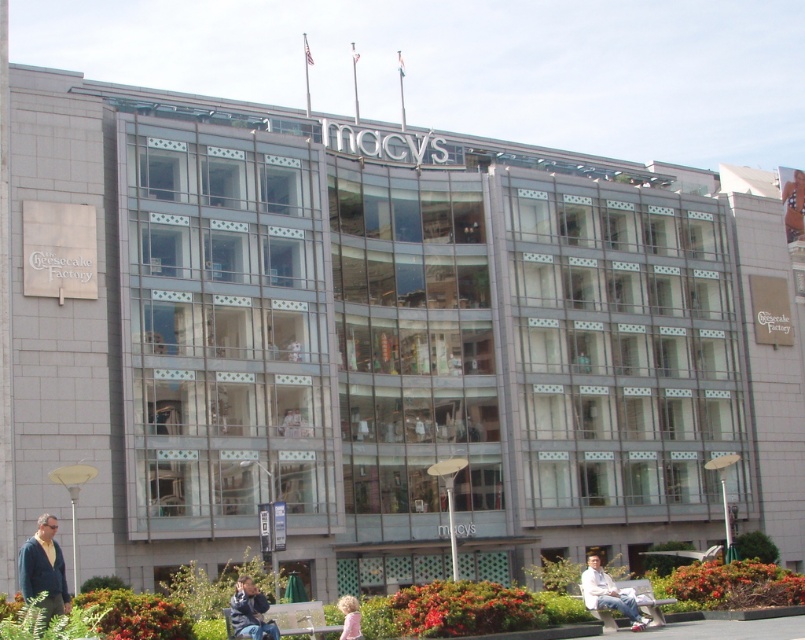
You are a customer looking at the Macy store display. You see light blue jeans at lower right and blue denim jeans at lower center. Which pair of jeans is positioned more to the right side of the display?

The light blue jeans at lower right is positioned more to the right side of the display than the blue denim jeans at lower center.

You are standing in front of the Macy building and want to take a photo of the point at coordinates (56, 609). The camera you have can focus on objects up to 100 feet away. Will the point be in focus?

The point at coordinates (56, 609) is 92.19 feet from the camera, which is within the camera focus range of up to 100 feet. Therefore, the point will be in focus.

You are a photographer standing in front of the Macy store and want to take a picture of the dark blue sweater at lower left and the blonde hair at lower center. Which object should you focus on first if you want to capture both in the same frame without moving the camera?

The dark blue sweater at lower left should be focused on first because it is larger in size compared to the blonde hair at lower center, ensuring it fits well within the frame while still capturing the smaller object.